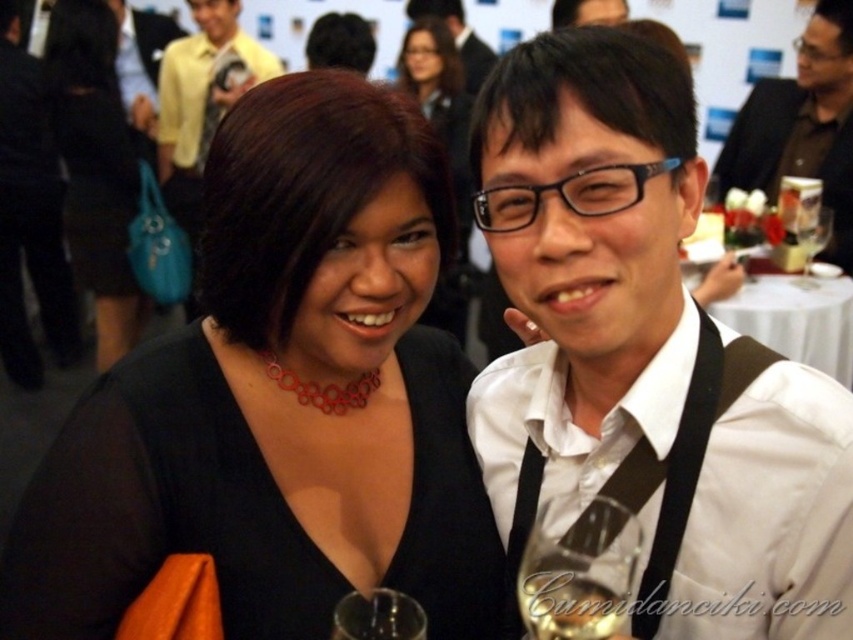
You are a photographer at the event and want to place a 10 cm wide decorative item on the table where the translucent glass wine at center is located. Can the brown leather jacket at upper right be used as a support for the item?

The brown leather jacket at upper right has a larger size compared to the translucent glass wine at center. Since the jacket is larger, it can provide a stable base to support the decorative item.

You are a photographer at the event and want to ensure that both the white matte shirt at center and the matte black hair at upper center are clearly visible in your photo. Which object should you focus on to ensure it doesn t get cropped out if the frame is tight?

The white matte shirt at center has a lesser width compared to matte black hair at upper center, so you should focus on capturing the wider matte black hair at upper center to ensure it doesn t get cropped out in a tight frame.